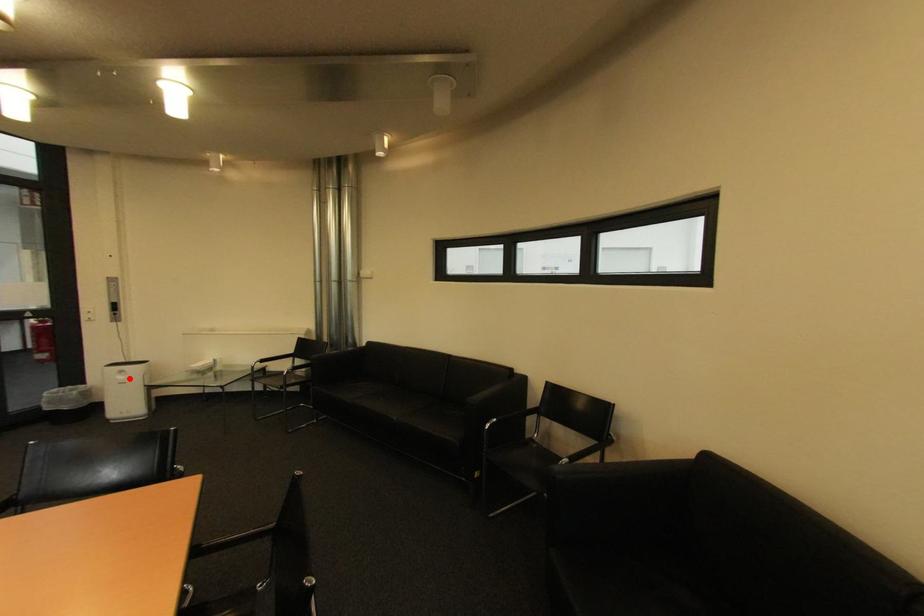
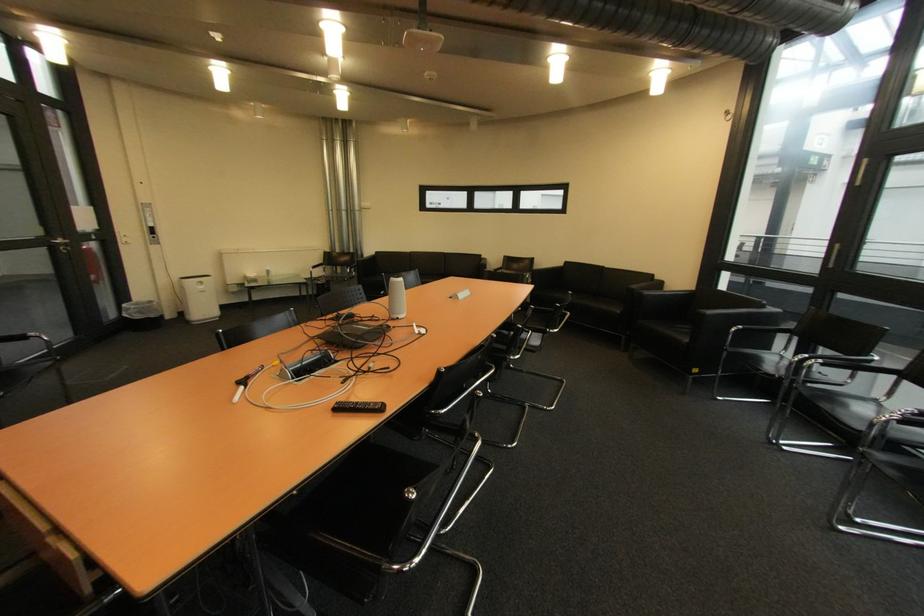
Locate, in the second image, the point that corresponds to the highlighted location in the first image.

(209, 288)